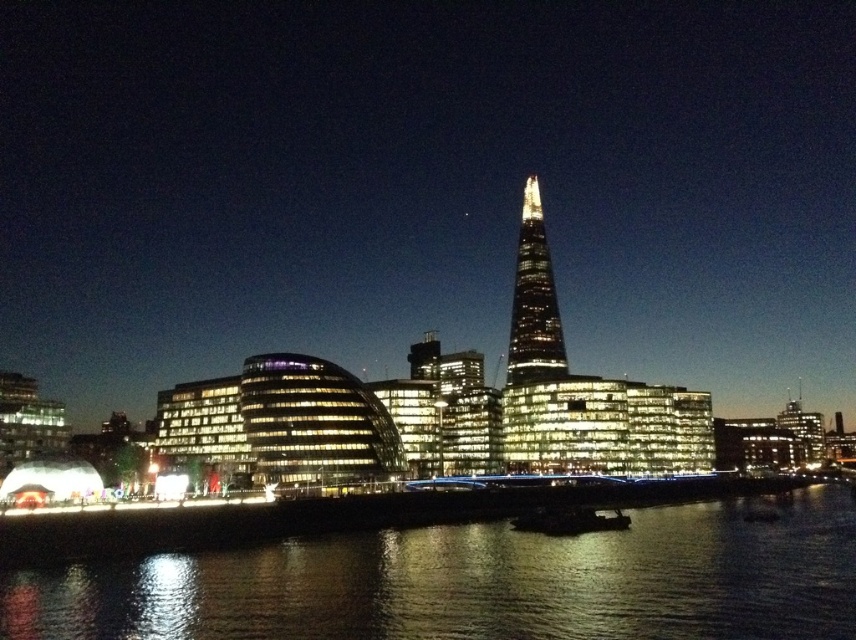
Question: Is black reflective water at lower center to the left of glassy reflective skyscraper at center from the viewer's perspective?

Choices:
 (A) yes
 (B) no

Answer: (A)

Question: Is black reflective water at lower center positioned before glassy reflective skyscraper at center?

Choices:
 (A) yes
 (B) no

Answer: (A)

Question: Which point is closer to the camera?

Choices:
 (A) (795, 596)
 (B) (522, 282)

Answer: (A)

Question: Is black reflective water at lower center bigger than glassy reflective skyscraper at center?

Choices:
 (A) yes
 (B) no

Answer: (B)